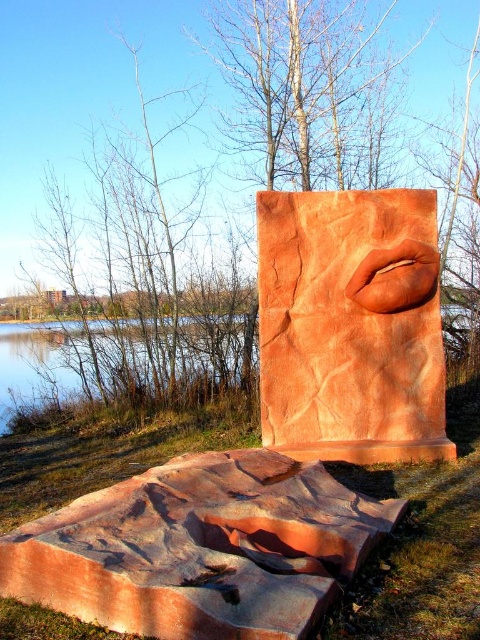
You are standing 10 meters away from the sculpture. Can you see the point at coordinates point (27, 228) on the sculpture from your current position?

The point at coordinates point (27, 228) is 12.35 meters away from the viewer. Since you are only 10 meters away from the sculpture, you cannot see the point at coordinates point (27, 228) because it is further away than your current distance.

You are standing at the point labeled point (103,108) in the sculpture area. What object is located at that specific coordinate?

The point (103,108) corresponds to the brown wood tree at center.